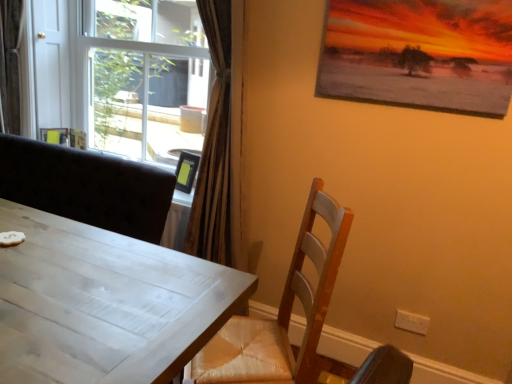
The width and height of the screenshot is (512, 384). What are the coordinates of `vacant region above white wood table at left (from a real-world perspective)` in the screenshot? It's located at (77, 282).